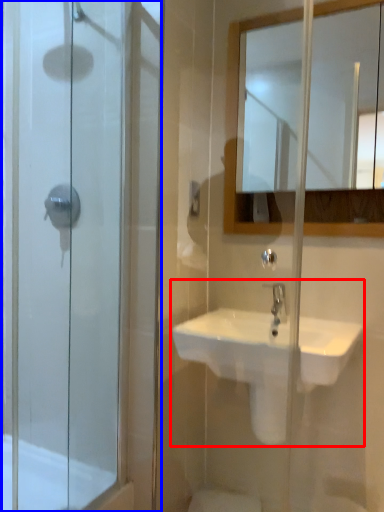
Question: Which object is further to the camera taking this photo, sink (highlighted by a red box) or screen door (highlighted by a blue box)?

Choices:
 (A) sink
 (B) screen door

Answer: (A)